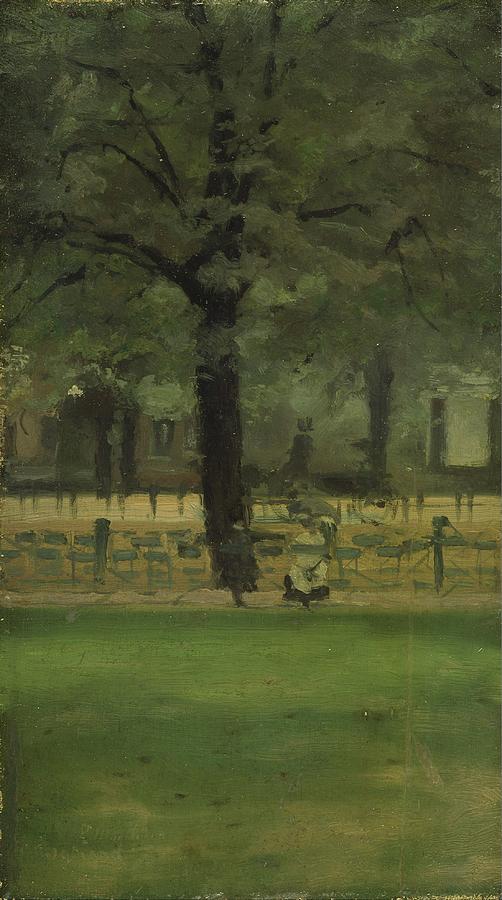
Where is `windows`? windows is located at coordinates (4, 454), (40, 421), (153, 429).